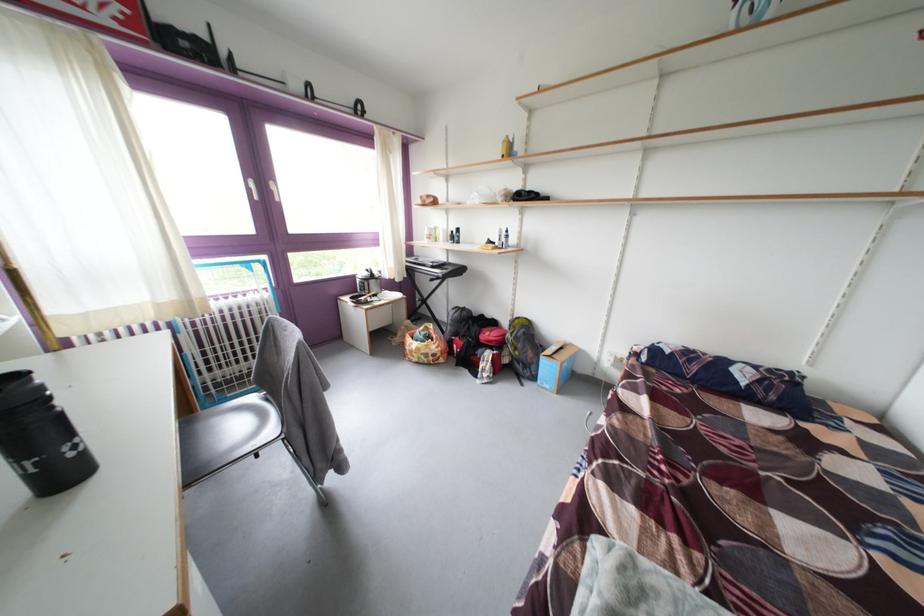
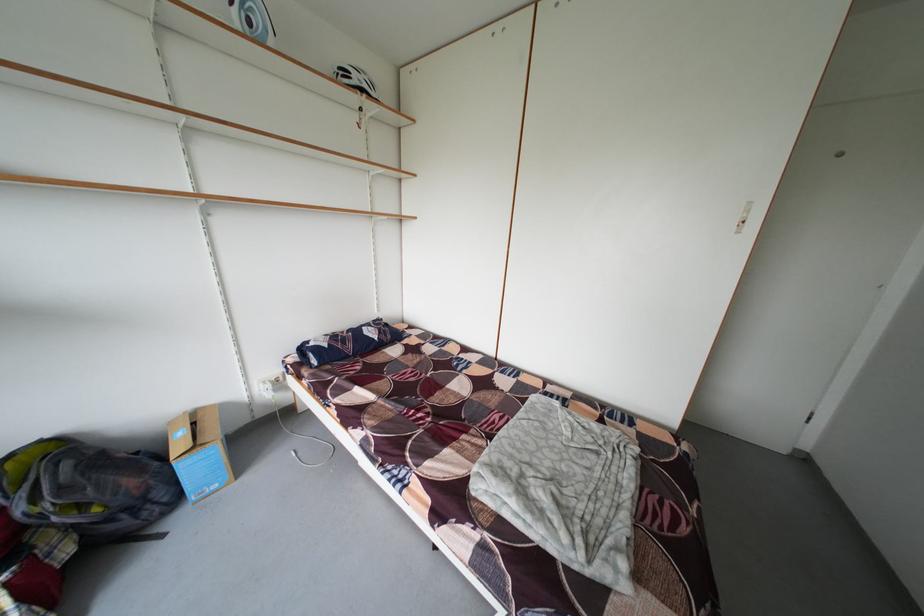
Find the pixel in the second image that matches pixel 706 373 in the first image.

(360, 351)